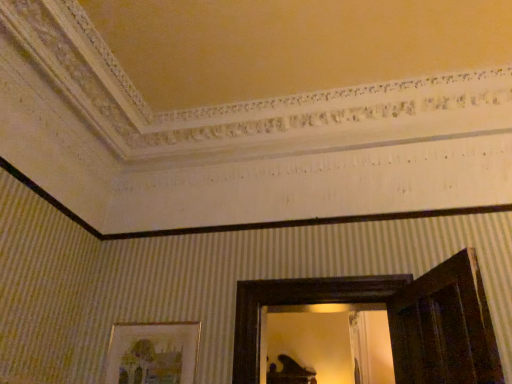
What is the approximate height of gold metallic picture frame at lower left?

gold metallic picture frame at lower left is 46.05 centimeters tall.

What do you see at coordinates (152, 353) in the screenshot?
I see `gold metallic picture frame at lower left` at bounding box center [152, 353].

Find the location of a particular element. gold metallic picture frame at lower left is located at coordinates (152, 353).

You are a GUI agent. You are given a task and a screenshot of the screen. Output one action in this format:
    pyautogui.click(x=<x>, y=<y>)
    Task: Click on the gold metallic picture frame at lower left
    
    Given the screenshot: What is the action you would take?
    pyautogui.click(x=152, y=353)